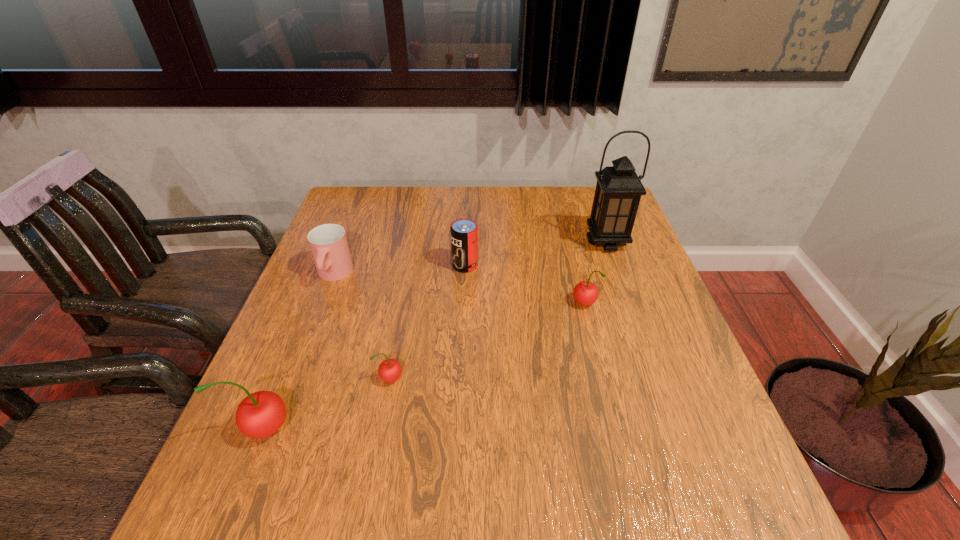
At what (x,y) coordinates should I click in order to perform the action: click on free space located 0.080m on the right of the leftmost cherry. Please return your answer as a coordinate pair (x, y). Looking at the image, I should click on [333, 428].

At what (x,y) coordinates should I click in order to perform the action: click on free space located on the back of the fifth farthest object. Please return your answer as a coordinate pair (x, y). This screenshot has height=540, width=960. Looking at the image, I should click on (406, 298).

Locate an element on the screen. The image size is (960, 540). vacant space situated 0.160m on the front of the fourth farthest object is located at coordinates (601, 369).

Find the location of a particular element. free spot located 0.180m on the back of the rightmost object is located at coordinates (591, 199).

Find the location of a particular element. This screenshot has height=540, width=960. free space located on the side of the cup with the handle is located at coordinates (x=305, y=350).

Where is `vacant space located 0.090m on the back of the third object from right to left`? vacant space located 0.090m on the back of the third object from right to left is located at coordinates (467, 238).

The height and width of the screenshot is (540, 960). Identify the location of object located in the near edge section of the desktop. (261, 414).

Identify the location of cherry that is at the left edge. This screenshot has width=960, height=540. (261, 414).

You are a GUI agent. You are given a task and a screenshot of the screen. Output one action in this format:
    pyautogui.click(x=<x>, y=<y>)
    Task: Click on the cup present at the left edge
    This screenshot has width=960, height=540.
    Given the screenshot: What is the action you would take?
    pyautogui.click(x=328, y=242)

Find the location of a particular element. This screenshot has height=540, width=960. object present at the right edge is located at coordinates [x=618, y=191].